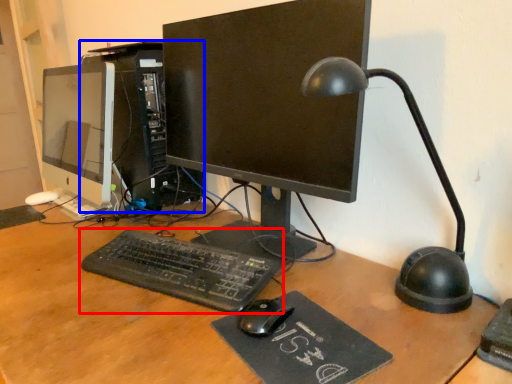
Question: Which point is closer to the camera, computer keyboard (highlighted by a red box) or computer tower (highlighted by a blue box)?

Choices:
 (A) computer keyboard
 (B) computer tower

Answer: (A)